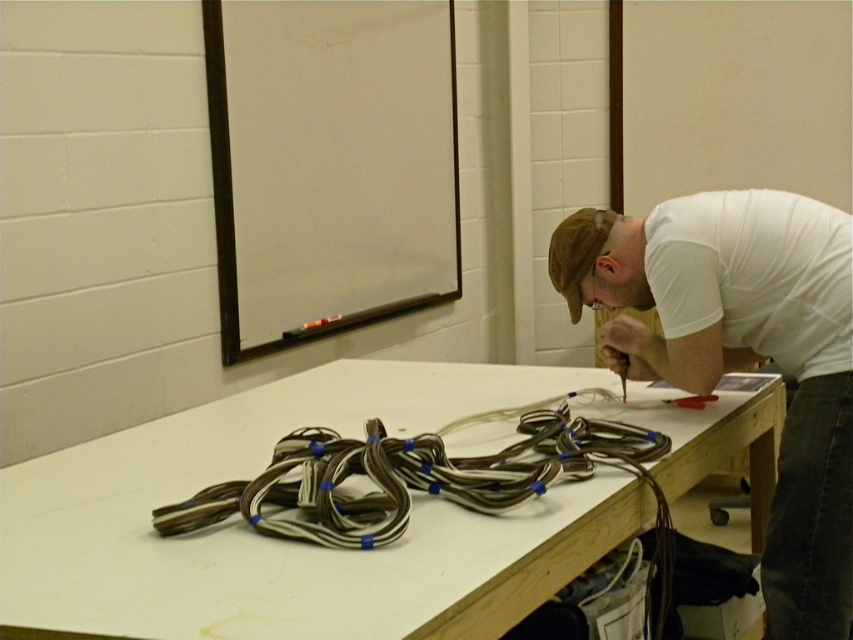
Does white cotton shirt at upper right have a larger size compared to brown rubberized cables at center?

Correct, white cotton shirt at upper right is larger in size than brown rubberized cables at center.

Locate an element on the screen. white cotton shirt at upper right is located at coordinates (743, 355).

Does point (374, 620) come closer to viewer compared to point (155, 529)?

That is True.

Who is higher up, white matte table at center or brown rubberized cables at center?

brown rubberized cables at center

Is point (399, 572) positioned after point (355, 472)?

No, (399, 572) is closer to viewer.

This screenshot has width=853, height=640. In order to click on white matte table at center in this screenshot , I will do `click(288, 541)`.

Does white matte table at center lie in front of white cotton shirt at upper right?

Yes, white matte table at center is closer to the viewer.

Where is `white matte table at center`? Image resolution: width=853 pixels, height=640 pixels. white matte table at center is located at coordinates (288, 541).

Who is more distant from viewer, (248, 600) or (659, 376)?

The point (659, 376) is behind.

The image size is (853, 640). Find the location of `white matte table at center`. white matte table at center is located at coordinates (288, 541).